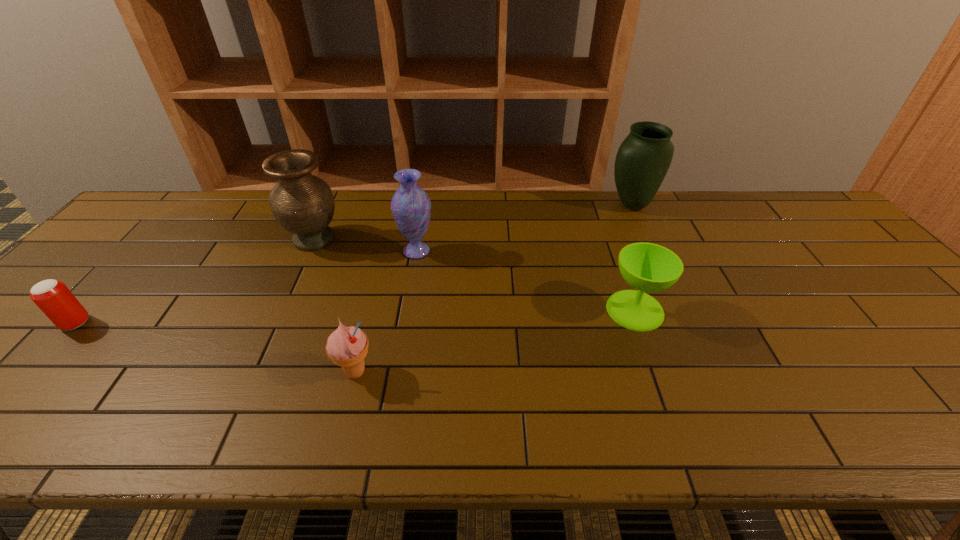
This screenshot has height=540, width=960. Find the location of `the second closest vase to the wineglass`. the second closest vase to the wineglass is located at coordinates (411, 207).

Where is `free location that satisfies the following two spatial constraints: 1. on the back side of the wineglass; 2. on the right side of the icecream`? free location that satisfies the following two spatial constraints: 1. on the back side of the wineglass; 2. on the right side of the icecream is located at coordinates (372, 310).